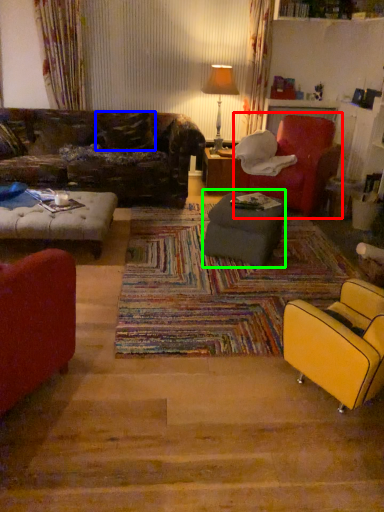
Question: Considering the real-world distances, which object is farthest from chair (highlighted by a red box)? pillow (highlighted by a blue box) or table (highlighted by a green box)?

Choices:
 (A) pillow
 (B) table

Answer: (A)